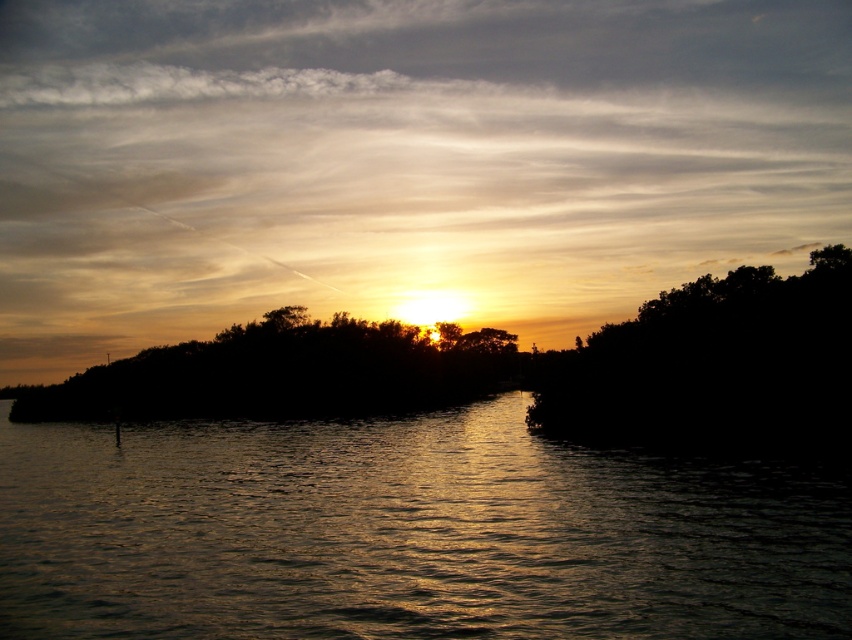
Can you confirm if silvery reflective water at center is smaller than silhouette leafy tree at right?

Correct, silvery reflective water at center occupies less space than silhouette leafy tree at right.

Does silvery reflective water at center have a lesser height compared to silhouette leafy tree at right?

Yes, silvery reflective water at center is shorter than silhouette leafy tree at right.

Is point (568, 636) positioned in front of point (545, 372)?

Yes, it is.

I want to click on silvery reflective water at center, so click(x=407, y=532).